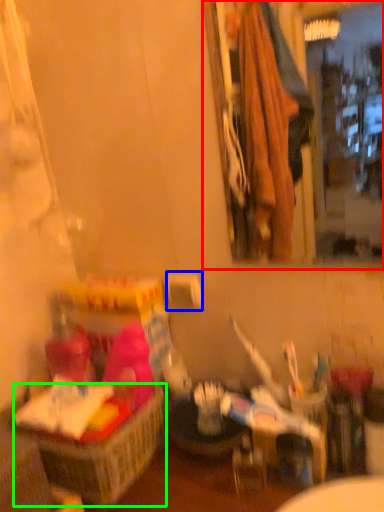
Question: Estimate the real-world distances between objects in this image. Which object is closer to mirror (highlighted by a red box), toilet paper (highlighted by a blue box) or basket (highlighted by a green box)?

Choices:
 (A) toilet paper
 (B) basket

Answer: (A)